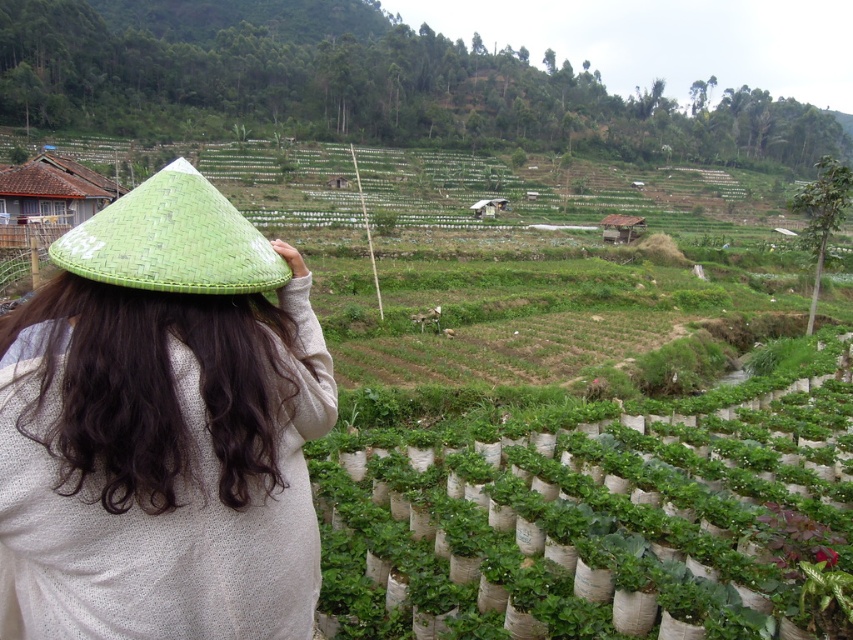
Based on the photo, between green woven hat at upper left and green woven hat at upper center, which one appears on the right side from the viewer's perspective?

Positioned to the right is green woven hat at upper center.

Locate an element on the screen. green woven hat at upper left is located at coordinates (161, 428).

Is the position of green woven hat at upper center less distant than that of green woven straw hat at upper left?

No.

The image size is (853, 640). I want to click on green woven hat at upper center, so click(368, 90).

Is point (393, 99) positioned in front of point (102, 216)?

No, it is behind (102, 216).

Identify the location of green woven hat at upper center. (368, 90).

Can you confirm if green leafy plants at center is bigger than green woven hat at upper center?

No, green leafy plants at center is not bigger than green woven hat at upper center.

How distant is green leafy plants at center from green woven hat at upper center?

green leafy plants at center is 193.96 meters away from green woven hat at upper center.

Which is in front, point (809, 518) or point (55, 112)?

Positioned in front is point (809, 518).

Where is `green leafy plants at center`? This screenshot has height=640, width=853. green leafy plants at center is located at coordinates (590, 513).